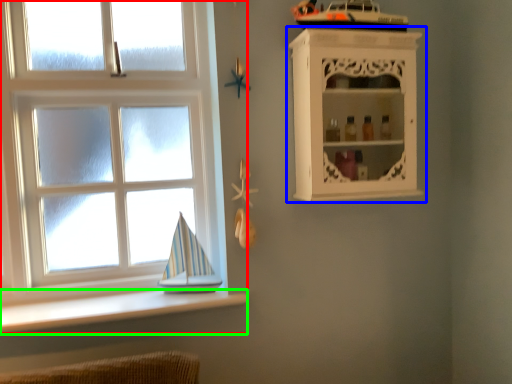
Question: Which is farther away from window (highlighted by a red box)? shelf (highlighted by a blue box) or ledge (highlighted by a green box)?

Choices:
 (A) shelf
 (B) ledge

Answer: (A)